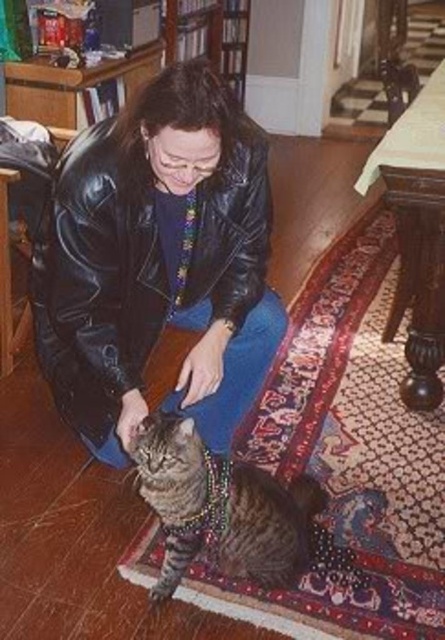
Question: Can you confirm if black leather jacket at center is positioned to the left of tabby fur cat at center?

Choices:
 (A) no
 (B) yes

Answer: (B)

Question: Which of the following is the closest to the observer?

Choices:
 (A) (141, 488)
 (B) (230, 280)

Answer: (A)

Question: Does black leather jacket at center have a lesser width compared to tabby fur cat at center?

Choices:
 (A) yes
 (B) no

Answer: (B)

Question: Which point is farther to the camera?

Choices:
 (A) (217, 545)
 (B) (152, 282)

Answer: (B)

Question: Which object appears farthest from the camera in this image?

Choices:
 (A) black leather jacket at center
 (B) tabby fur cat at center

Answer: (A)

Question: Does black leather jacket at center have a smaller size compared to tabby fur cat at center?

Choices:
 (A) yes
 (B) no

Answer: (B)